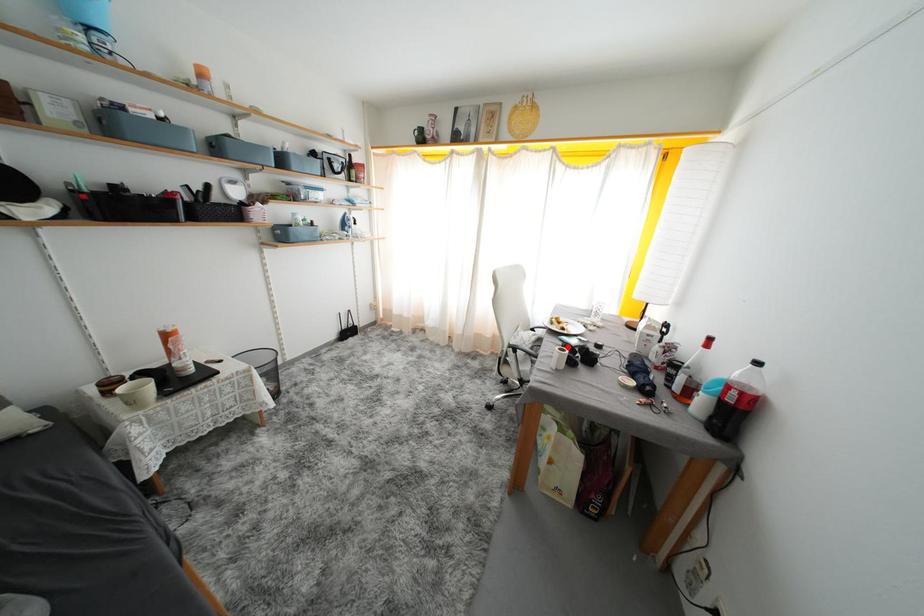
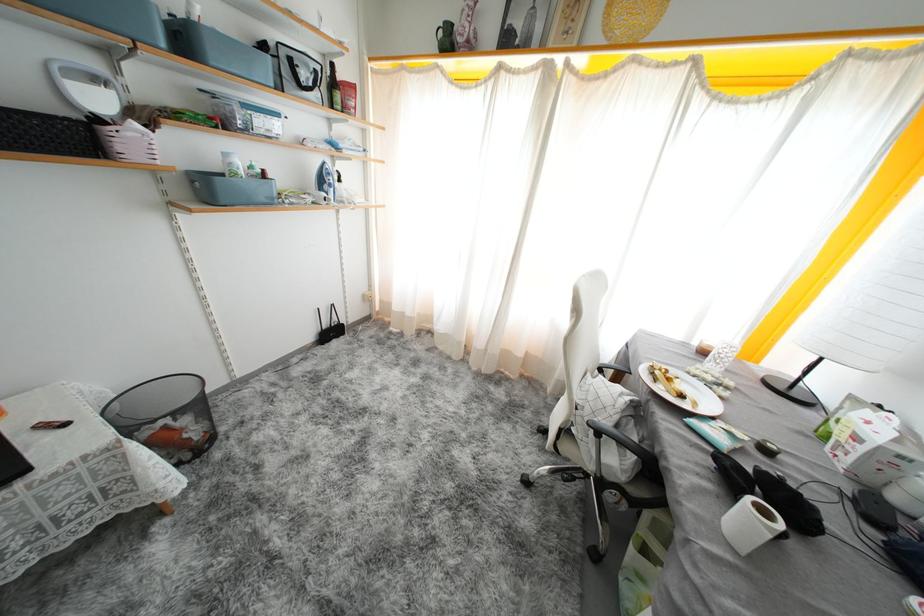
The point at the highlighted location is marked in the first image. Where is the corresponding point in the second image?

(716, 454)